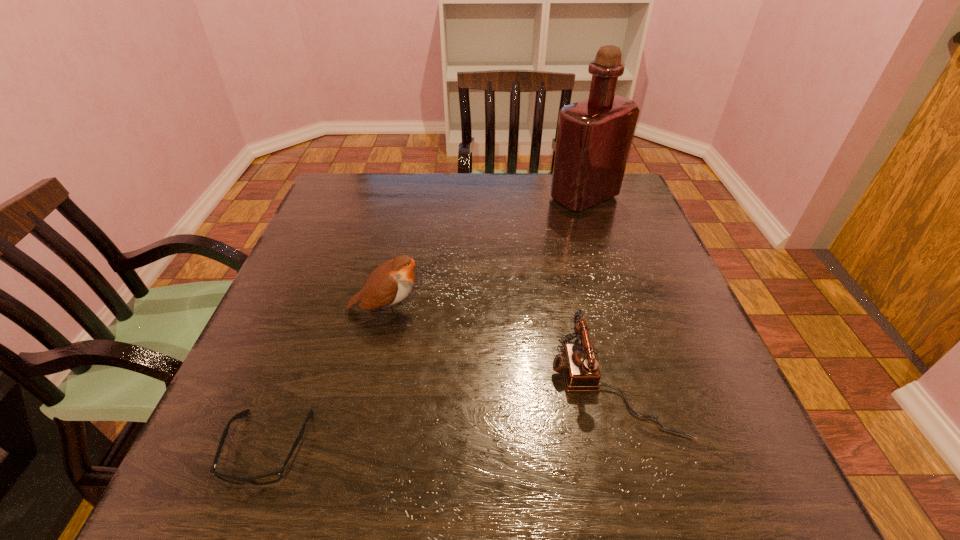
Image resolution: width=960 pixels, height=540 pixels. In the image, there is a desktop. Identify the location of vacant region at the near edge. (548, 478).

At what (x,y) coordinates should I click in order to perform the action: click on vacant area at the left edge of the desktop. Please return your answer as a coordinate pair (x, y). Looking at the image, I should click on (234, 381).

Locate an element on the screen. The height and width of the screenshot is (540, 960). vacant space at the right edge of the desktop is located at coordinates (615, 266).

Where is `vacant space at the far left corner of the desktop`? The height and width of the screenshot is (540, 960). vacant space at the far left corner of the desktop is located at coordinates (334, 187).

Image resolution: width=960 pixels, height=540 pixels. I want to click on unoccupied area between the telephone and the bird, so click(500, 347).

Identify the location of free space between the third nearest object and the farthest object. (486, 253).

Where is `blank region between the tallest object and the bird`? blank region between the tallest object and the bird is located at coordinates (486, 253).

The image size is (960, 540). Find the location of `free space between the spectacles and the tallest object`. free space between the spectacles and the tallest object is located at coordinates (425, 322).

Find the location of a particular element. The height and width of the screenshot is (540, 960). vacant space in between the farthest object and the third tallest object is located at coordinates (599, 291).

Where is `vacant area between the telephone and the second farthest object`? This screenshot has height=540, width=960. vacant area between the telephone and the second farthest object is located at coordinates (500, 347).